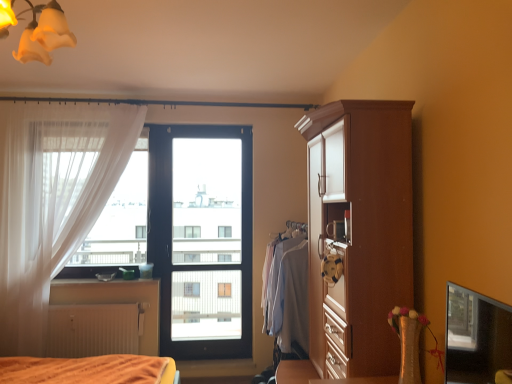
Question: Can you confirm if yellow frosted glass light fixture at upper left is bigger than transparent glass window screen at lower right?

Choices:
 (A) yes
 (B) no

Answer: (A)

Question: Is yellow frosted glass light fixture at upper left wider than transparent glass window screen at lower right?

Choices:
 (A) yes
 (B) no

Answer: (A)

Question: Does yellow frosted glass light fixture at upper left have a lesser width compared to transparent glass window screen at lower right?

Choices:
 (A) no
 (B) yes

Answer: (A)

Question: From a real-world perspective, does yellow frosted glass light fixture at upper left sit lower than transparent glass window screen at lower right?

Choices:
 (A) yes
 (B) no

Answer: (B)

Question: Is the depth of yellow frosted glass light fixture at upper left less than that of transparent glass window screen at lower right?

Choices:
 (A) no
 (B) yes

Answer: (A)

Question: From a real-world perspective, does yellow frosted glass light fixture at upper left stand above transparent glass window screen at lower right?

Choices:
 (A) no
 (B) yes

Answer: (B)

Question: Is white matte radiator at lower left not within matte wood cupboard at right?

Choices:
 (A) no
 (B) yes

Answer: (B)

Question: From a real-world perspective, is white matte radiator at lower left positioned over matte wood cupboard at right based on gravity?

Choices:
 (A) no
 (B) yes

Answer: (A)

Question: From a real-world perspective, is white matte radiator at lower left located beneath matte wood cupboard at right?

Choices:
 (A) no
 (B) yes

Answer: (B)

Question: From the image's perspective, is white matte radiator at lower left below matte wood cupboard at right?

Choices:
 (A) no
 (B) yes

Answer: (B)

Question: Can you confirm if white matte radiator at lower left is taller than matte wood cupboard at right?

Choices:
 (A) yes
 (B) no

Answer: (B)

Question: Does white matte radiator at lower left come in front of matte wood cupboard at right?

Choices:
 (A) yes
 (B) no

Answer: (B)

Question: Is transparent glass screen door at center smaller than white sheer curtain at left?

Choices:
 (A) yes
 (B) no

Answer: (A)